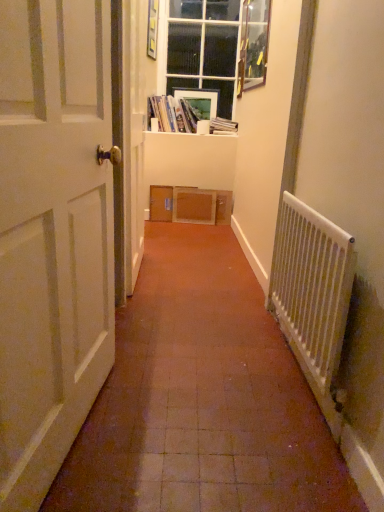
Question: Would you say white plastic radiator at right contains clear glass window at upper center?

Choices:
 (A) yes
 (B) no

Answer: (B)

Question: Would you say white plastic radiator at right is a long distance from clear glass window at upper center?

Choices:
 (A) yes
 (B) no

Answer: (A)

Question: Does white plastic radiator at right have a greater width compared to clear glass window at upper center?

Choices:
 (A) yes
 (B) no

Answer: (B)

Question: From a real-world perspective, does white plastic radiator at right sit lower than clear glass window at upper center?

Choices:
 (A) no
 (B) yes

Answer: (B)

Question: Can you confirm if white plastic radiator at right is positioned to the right of clear glass window at upper center?

Choices:
 (A) yes
 (B) no

Answer: (A)

Question: Does white plastic radiator at right have a larger size compared to clear glass window at upper center?

Choices:
 (A) no
 (B) yes

Answer: (A)

Question: Are white matte door at left and hardcover book at upper center, which appears as the 2th book when viewed from the left, far apart?

Choices:
 (A) yes
 (B) no

Answer: (A)

Question: Can you confirm if white matte door at left is taller than hardcover book at upper center, which is the first book in right-to-left order?

Choices:
 (A) yes
 (B) no

Answer: (A)

Question: From the image's perspective, would you say white matte door at left is positioned over hardcover book at upper center, which appears as the 2th book when viewed from the left?

Choices:
 (A) yes
 (B) no

Answer: (B)

Question: Considering the relative positions of white matte door at left and hardcover book at upper center, which appears as the 2th book when viewed from the left, in the image provided, is white matte door at left to the left of hardcover book at upper center, which appears as the 2th book when viewed from the left, from the viewer's perspective?

Choices:
 (A) no
 (B) yes

Answer: (B)

Question: Considering the relative sizes of white matte door at left and hardcover book at upper center, which appears as the 2th book when viewed from the left, in the image provided, is white matte door at left bigger than hardcover book at upper center, which appears as the 2th book when viewed from the left,?

Choices:
 (A) yes
 (B) no

Answer: (A)

Question: Is white matte door at left smaller than hardcover book at upper center, which appears as the 2th book when viewed from the left?

Choices:
 (A) yes
 (B) no

Answer: (B)

Question: From a real-world perspective, is wooden picture frame at upper right, arranged as the 2th picture frame when viewed from the back, over matte plastic picture frame at upper center, the second picture frame in the right-to-left sequence?

Choices:
 (A) no
 (B) yes

Answer: (B)